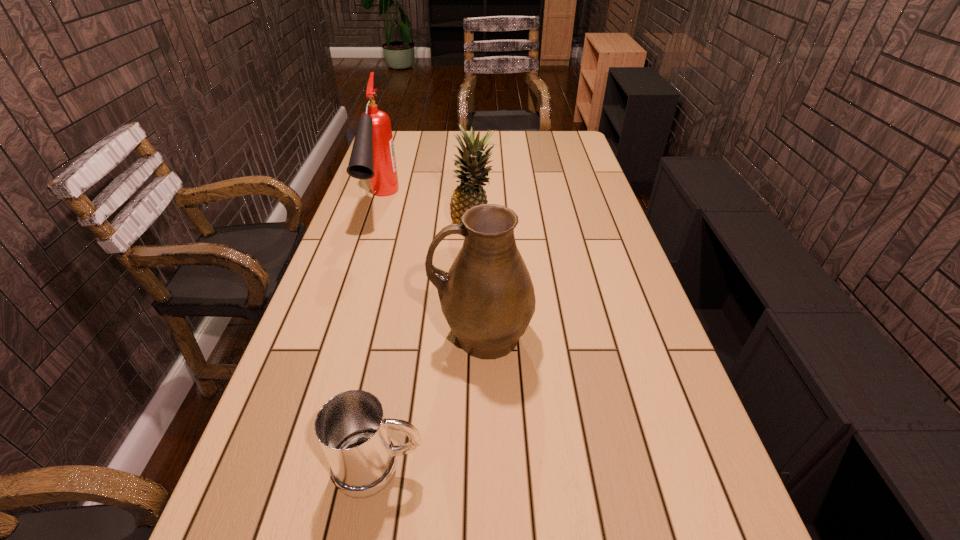
Identify the location of vacant space that satisfies the following two spatial constraints: 1. at the nozzle of the leftmost object; 2. on the handle side of the second nearest object. The image size is (960, 540). (339, 335).